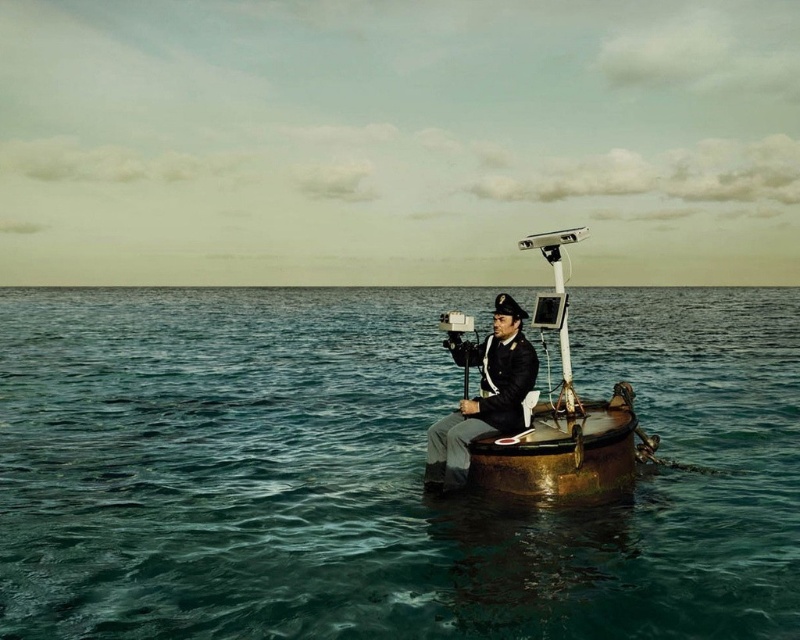
From the picture: Does greenish-blue water at center lie in front of matte black uniform at center?

Yes.

Does greenish-blue water at center have a greater height compared to matte black uniform at center?

Yes.

Who is more distant from viewer, (x=16, y=316) or (x=460, y=456)?

Positioned behind is point (x=16, y=316).

At what (x,y) coordinates should I click in order to perform the action: click on greenish-blue water at center. Please return your answer as a coordinate pair (x, y). Looking at the image, I should click on (380, 470).

Can you confirm if greenish-blue water at center is taller than rusty metal bucket at center?

Yes, greenish-blue water at center is taller than rusty metal bucket at center.

Is point (736, 545) closer to camera compared to point (541, 320)?

Yes, it is in front of point (541, 320).

Who is more distant from viewer, (782, 538) or (496, 301)?

The point (496, 301) is behind.

The image size is (800, 640). What are the coordinates of `greenish-blue water at center` in the screenshot? It's located at (380, 470).

Is rusty metal bucket at center closer to the viewer compared to matte black uniform at center?

No, it is behind matte black uniform at center.

Identify the location of rusty metal bucket at center. The height and width of the screenshot is (640, 800). (545, 406).